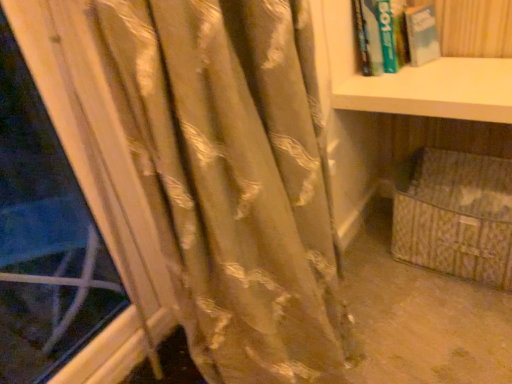
Question: From a real-world perspective, is beige woven basket at lower right located beneath beige fabric basket at lower right?

Choices:
 (A) yes
 (B) no

Answer: (A)

Question: Does beige woven basket at lower right turn towards beige fabric basket at lower right?

Choices:
 (A) yes
 (B) no

Answer: (A)

Question: Considering the relative sizes of beige woven basket at lower right and beige fabric basket at lower right in the image provided, is beige woven basket at lower right taller than beige fabric basket at lower right?

Choices:
 (A) yes
 (B) no

Answer: (B)

Question: Is beige woven basket at lower right further to camera compared to beige fabric basket at lower right?

Choices:
 (A) no
 (B) yes

Answer: (B)

Question: Would you say beige fabric basket at lower right is part of beige woven basket at lower right's contents?

Choices:
 (A) yes
 (B) no

Answer: (A)

Question: From a real-world perspective, is green matte book at upper right positioned above or below beige fabric basket at lower right?

Choices:
 (A) below
 (B) above

Answer: (B)

Question: Is green matte book at upper right inside the boundaries of beige fabric basket at lower right, or outside?

Choices:
 (A) outside
 (B) inside

Answer: (A)

Question: Looking at the image, does green matte book at upper right seem bigger or smaller compared to beige fabric basket at lower right?

Choices:
 (A) big
 (B) small

Answer: (B)

Question: From their relative heights in the image, would you say green matte book at upper right is taller or shorter than beige fabric basket at lower right?

Choices:
 (A) short
 (B) tall

Answer: (A)

Question: Looking at the image, does green matte book at upper right seem bigger or smaller compared to satin gold curtain at left?

Choices:
 (A) big
 (B) small

Answer: (B)

Question: Considering the positions of green matte book at upper right and satin gold curtain at left in the image, is green matte book at upper right taller or shorter than satin gold curtain at left?

Choices:
 (A) short
 (B) tall

Answer: (A)

Question: Relative to satin gold curtain at left, is green matte book at upper right in front or behind?

Choices:
 (A) front
 (B) behind

Answer: (B)

Question: In the image, is green matte book at upper right on the left side or the right side of satin gold curtain at left?

Choices:
 (A) left
 (B) right

Answer: (B)

Question: Choose the correct answer: Is satin gold curtain at left inside beige fabric basket at lower right or outside it?

Choices:
 (A) inside
 (B) outside

Answer: (B)

Question: In terms of height, does satin gold curtain at left look taller or shorter compared to beige fabric basket at lower right?

Choices:
 (A) tall
 (B) short

Answer: (A)